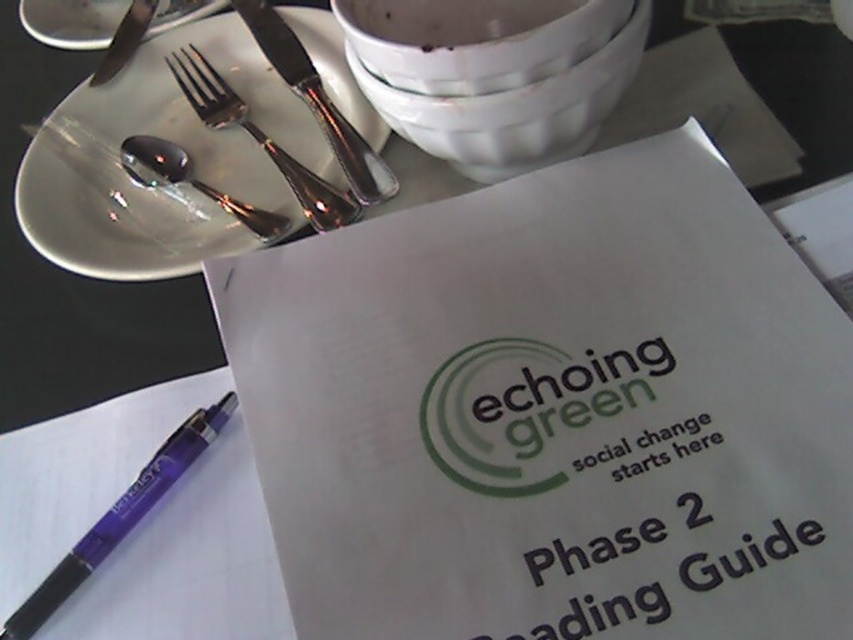
Can you confirm if silver metallic fork at upper left is positioned to the right of shiny silver spoon at upper left?

Incorrect, silver metallic fork at upper left is not on the right side of shiny silver spoon at upper left.

Is silver metallic fork at upper left to the left of shiny silver spoon at upper left from the viewer's perspective?

Correct, you'll find silver metallic fork at upper left to the left of shiny silver spoon at upper left.

The height and width of the screenshot is (640, 853). Find the location of `silver metallic fork at upper left`. silver metallic fork at upper left is located at coordinates (73, 20).

Is white porcelain plate at upper left above polished silver fork at upper left?

No.

Does white porcelain plate at upper left have a greater height compared to polished silver fork at upper left?

Yes, white porcelain plate at upper left is taller than polished silver fork at upper left.

Image resolution: width=853 pixels, height=640 pixels. Describe the element at coordinates (169, 140) in the screenshot. I see `white porcelain plate at upper left` at that location.

Identify the location of white porcelain plate at upper left. click(169, 140).

Is white porcelain plate at upper left in front of satin silver knife at upper left?

Yes.

Is white porcelain plate at upper left bigger than satin silver knife at upper left?

Yes, white porcelain plate at upper left is bigger than satin silver knife at upper left.

Who is more distant from viewer, (62,218) or (288,42)?

Point (288,42)

At what (x,y) coordinates should I click in order to perform the action: click on white porcelain plate at upper left. Please return your answer as a coordinate pair (x, y). This screenshot has width=853, height=640. Looking at the image, I should click on (169, 140).